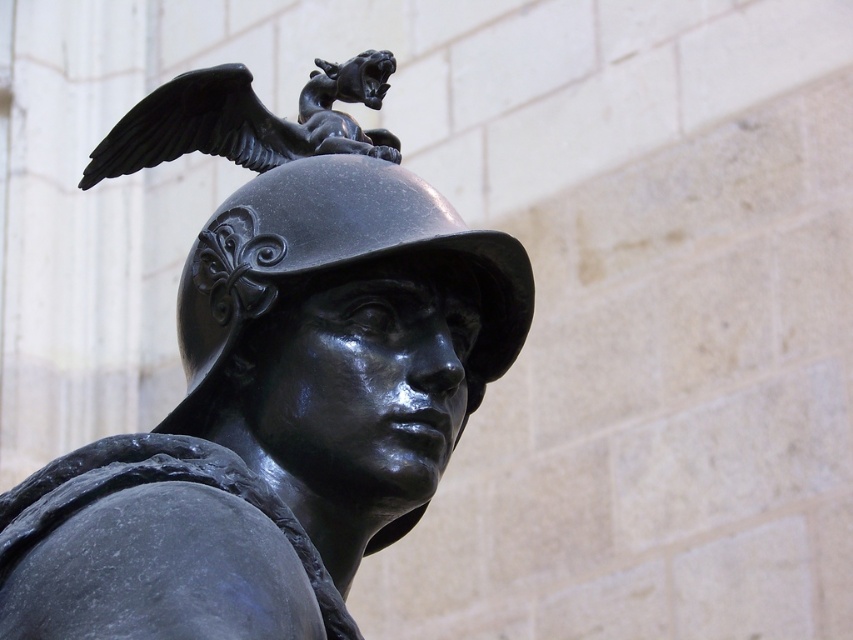
Between shiny black helmet at center and polished bronze eagle at upper center, which one is positioned lower?

Positioned lower is shiny black helmet at center.

Looking at this image, is shiny black helmet at center to the right of polished bronze eagle at upper center from the viewer's perspective?

Indeed, shiny black helmet at center is positioned on the right side of polished bronze eagle at upper center.

Identify the location of shiny black helmet at center. Image resolution: width=853 pixels, height=640 pixels. (329, 262).

Locate an element on the screen. Image resolution: width=853 pixels, height=640 pixels. shiny black helmet at center is located at coordinates (329, 262).

Is bronze helmet at center above shiny black helmet at center?

Actually, bronze helmet at center is below shiny black helmet at center.

Who is taller, bronze helmet at center or shiny black helmet at center?

bronze helmet at center

Between point (281, 518) and point (312, 198), which one is positioned behind?

The point (312, 198) is behind.

Identify the location of bronze helmet at center. The height and width of the screenshot is (640, 853). point(273,381).

Can you confirm if bronze helmet at center is positioned to the right of polished bronze eagle at upper center?

Correct, you'll find bronze helmet at center to the right of polished bronze eagle at upper center.

Is point (425, 314) positioned after point (136, 150)?

No, (425, 314) is closer to viewer.

Locate an element on the screen. The height and width of the screenshot is (640, 853). bronze helmet at center is located at coordinates (273, 381).